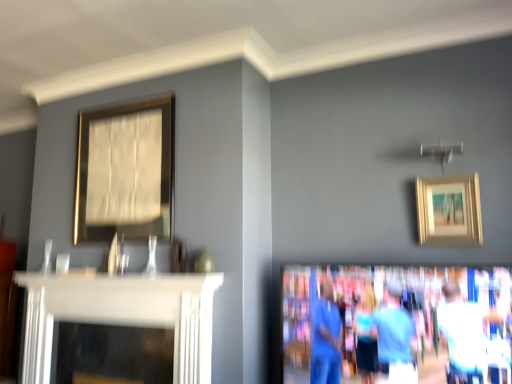
How much space does gold/golden frame at upper right, positioned as the 2th picture frame in back-to-front order, occupy vertically?

gold/golden frame at upper right, positioned as the 2th picture frame in back-to-front order, is 14.06 inches in height.

In the scene shown: Measure the distance between gold/golden frame at upper right, the first picture frame from the front, and camera.

gold/golden frame at upper right, the first picture frame from the front, and camera are 6.59 feet apart from each other.

What is the approximate height of white glossy fireplace at left?

The height of white glossy fireplace at left is 62.16 centimeters.

What is the approximate width of blue fabric couple at lower right?

7.05 inches.

Identify the location of gold/golden frame at upper right, positioned as the 2th picture frame in back-to-front order. (449, 210).

Where is `couple that is under the gold metallic picture frame at upper left, the second picture frame in the front-to-back sequence (from a real-world perspective)`? couple that is under the gold metallic picture frame at upper left, the second picture frame in the front-to-back sequence (from a real-world perspective) is located at coordinates (421, 329).

Between blue fabric couple at lower right and gold metallic picture frame at upper left, the first picture frame viewed from the back, which one appears on the left side from the viewer's perspective?

gold metallic picture frame at upper left, the first picture frame viewed from the back.

Is the surface of blue fabric couple at lower right in direct contact with gold metallic picture frame at upper left, the second picture frame in the front-to-back sequence?

No, blue fabric couple at lower right is not beside gold metallic picture frame at upper left, the second picture frame in the front-to-back sequence.

Is blue fabric couple at lower right further to the viewer compared to gold metallic picture frame at upper left, the first picture frame in the left-to-right sequence?

No.

Is gold/golden frame at upper right, the first picture frame from the front, oriented away from blue fabric couple at lower right?

No, gold/golden frame at upper right, the first picture frame from the front, is not facing the opposite direction of blue fabric couple at lower right.

Considering the sizes of gold/golden frame at upper right, which ranks as the 1th picture frame in right-to-left order, and blue fabric couple at lower right in the image, is gold/golden frame at upper right, which ranks as the 1th picture frame in right-to-left order, wider or thinner than blue fabric couple at lower right?

In the image, gold/golden frame at upper right, which ranks as the 1th picture frame in right-to-left order, appears to be more narrow than blue fabric couple at lower right.

From their relative heights in the image, would you say gold/golden frame at upper right, acting as the second picture frame starting from the left, is taller or shorter than blue fabric couple at lower right?

Considering their sizes, gold/golden frame at upper right, acting as the second picture frame starting from the left, has less height than blue fabric couple at lower right.

Visually, is gold/golden frame at upper right, positioned as the 2th picture frame in back-to-front order, positioned to the left or to the right of blue fabric couple at lower right?

gold/golden frame at upper right, positioned as the 2th picture frame in back-to-front order, is to the right of blue fabric couple at lower right.

From a real-world perspective, does white glossy fireplace at left stand above blue fabric couple at lower right?

No, from a real-world perspective, white glossy fireplace at left is not above blue fabric couple at lower right.

The image size is (512, 384). Identify the location of fireplace to the left of blue fabric couple at lower right. (122, 315).

Does white glossy fireplace at left appear on the left side of blue fabric couple at lower right?

Correct, you'll find white glossy fireplace at left to the left of blue fabric couple at lower right.

Would you consider white glossy fireplace at left to be distant from blue fabric couple at lower right?

No, white glossy fireplace at left is not far away from blue fabric couple at lower right.

Considering the relative sizes of white glossy fireplace at left and gold/golden frame at upper right, acting as the second picture frame starting from the left, in the image provided, is white glossy fireplace at left thinner than gold/golden frame at upper right, acting as the second picture frame starting from the left,?

No.

Would you consider white glossy fireplace at left to be distant from gold/golden frame at upper right, acting as the second picture frame starting from the left?

Yes, white glossy fireplace at left and gold/golden frame at upper right, acting as the second picture frame starting from the left, are located far from each other.

Is white glossy fireplace at left looking in the opposite direction of gold/golden frame at upper right, the first picture frame from the front?

No.

From the image's perspective, between white glossy fireplace at left and gold/golden frame at upper right, positioned as the 2th picture frame in back-to-front order, who is located below?

white glossy fireplace at left is shown below in the image.

From the image's perspective, which one is positioned higher, gold metallic picture frame at upper left, the second picture frame in the front-to-back sequence, or blue fabric couple at lower right?

gold metallic picture frame at upper left, the second picture frame in the front-to-back sequence.

From a real-world perspective, is gold metallic picture frame at upper left, which ranks as the second picture frame in right-to-left order, on top of blue fabric couple at lower right?

Correct, in the physical world, gold metallic picture frame at upper left, which ranks as the second picture frame in right-to-left order, is higher than blue fabric couple at lower right.

Could you tell me if gold metallic picture frame at upper left, the first picture frame in the left-to-right sequence, is turned towards blue fabric couple at lower right?

No.

Would you say gold metallic picture frame at upper left, the first picture frame in the left-to-right sequence, is inside or outside blue fabric couple at lower right?

gold metallic picture frame at upper left, the first picture frame in the left-to-right sequence, is outside blue fabric couple at lower right.

Which of these two, blue fabric couple at lower right or gold/golden frame at upper right, positioned as the 2th picture frame in back-to-front order, is bigger?

blue fabric couple at lower right.

Is blue fabric couple at lower right not near gold/golden frame at upper right, positioned as the 2th picture frame in back-to-front order?

Actually, blue fabric couple at lower right and gold/golden frame at upper right, positioned as the 2th picture frame in back-to-front order, are a little close together.

Identify the location of couple that appears below the gold/golden frame at upper right, the first picture frame from the front (from a real-world perspective). This screenshot has width=512, height=384. (421, 329).

From the picture: Is gold metallic picture frame at upper left, the first picture frame in the left-to-right sequence, further to the viewer compared to white glossy fireplace at left?

Yes, it is behind white glossy fireplace at left.

From the image's perspective, count 2nd picture frames upward from the white glossy fireplace at left and point to it. Please provide its 2D coordinates.

[(125, 171)]

Is gold metallic picture frame at upper left, the second picture frame in the front-to-back sequence, to the left of white glossy fireplace at left from the viewer's perspective?

Correct, you'll find gold metallic picture frame at upper left, the second picture frame in the front-to-back sequence, to the left of white glossy fireplace at left.

From a real-world perspective, is gold metallic picture frame at upper left, which ranks as the second picture frame in right-to-left order, located higher than white glossy fireplace at left?

Yes, from a real-world perspective, gold metallic picture frame at upper left, which ranks as the second picture frame in right-to-left order, is on top of white glossy fireplace at left.

Identify the location of the 2nd picture frame positioned above the blue fabric couple at lower right (from a real-world perspective). The width and height of the screenshot is (512, 384). tap(125, 171).

Locate an element on the screen. The width and height of the screenshot is (512, 384). couple below the gold/golden frame at upper right, which ranks as the 1th picture frame in right-to-left order (from the image's perspective) is located at coordinates (421, 329).

Based on their spatial positions, is gold metallic picture frame at upper left, the first picture frame in the left-to-right sequence, or blue fabric couple at lower right further from gold/golden frame at upper right, positioned as the 2th picture frame in back-to-front order?

gold metallic picture frame at upper left, the first picture frame in the left-to-right sequence, lies further to gold/golden frame at upper right, positioned as the 2th picture frame in back-to-front order, than the other object.

Considering their positions, is blue fabric couple at lower right positioned further to gold/golden frame at upper right, the first picture frame from the front, than gold metallic picture frame at upper left, the second picture frame in the front-to-back sequence?

gold metallic picture frame at upper left, the second picture frame in the front-to-back sequence.

Based on their spatial positions, is gold metallic picture frame at upper left, which ranks as the second picture frame in right-to-left order, or white glossy fireplace at left further from gold/golden frame at upper right, which ranks as the 1th picture frame in right-to-left order?

gold metallic picture frame at upper left, which ranks as the second picture frame in right-to-left order.

Looking at the image, which one is located further to gold metallic picture frame at upper left, the first picture frame in the left-to-right sequence, white glossy fireplace at left or gold/golden frame at upper right, which ranks as the 1th picture frame in right-to-left order?

gold/golden frame at upper right, which ranks as the 1th picture frame in right-to-left order.

From the image, which object appears to be nearer to gold/golden frame at upper right, positioned as the 2th picture frame in back-to-front order, white glossy fireplace at left or blue fabric couple at lower right?

blue fabric couple at lower right lies closer to gold/golden frame at upper right, positioned as the 2th picture frame in back-to-front order, than the other object.

Looking at the image, which one is located closer to gold metallic picture frame at upper left, the second picture frame in the front-to-back sequence, white glossy fireplace at left or blue fabric couple at lower right?

white glossy fireplace at left.

When comparing their distances from gold/golden frame at upper right, the first picture frame from the front, does blue fabric couple at lower right or white glossy fireplace at left seem further?

white glossy fireplace at left lies further to gold/golden frame at upper right, the first picture frame from the front, than the other object.

When comparing their distances from blue fabric couple at lower right, does gold metallic picture frame at upper left, which ranks as the second picture frame in right-to-left order, or gold/golden frame at upper right, positioned as the 2th picture frame in back-to-front order, seem closer?

The object closer to blue fabric couple at lower right is gold/golden frame at upper right, positioned as the 2th picture frame in back-to-front order.

I want to click on couple located between gold metallic picture frame at upper left, which ranks as the second picture frame in right-to-left order, and gold/golden frame at upper right, which ranks as the 1th picture frame in right-to-left order, in the left-right direction, so click(x=421, y=329).

The image size is (512, 384). Find the location of `fireplace between gold metallic picture frame at upper left, the second picture frame in the front-to-back sequence, and gold/golden frame at upper right, positioned as the 2th picture frame in back-to-front order`. fireplace between gold metallic picture frame at upper left, the second picture frame in the front-to-back sequence, and gold/golden frame at upper right, positioned as the 2th picture frame in back-to-front order is located at coordinates (122, 315).

This screenshot has width=512, height=384. I want to click on couple between white glossy fireplace at left and gold/golden frame at upper right, acting as the second picture frame starting from the left, in the horizontal direction, so click(421, 329).

At what (x,y) coordinates should I click in order to perform the action: click on fireplace between gold metallic picture frame at upper left, the first picture frame viewed from the back, and blue fabric couple at lower right from left to right. Please return your answer as a coordinate pair (x, y). Image resolution: width=512 pixels, height=384 pixels. Looking at the image, I should click on (122, 315).